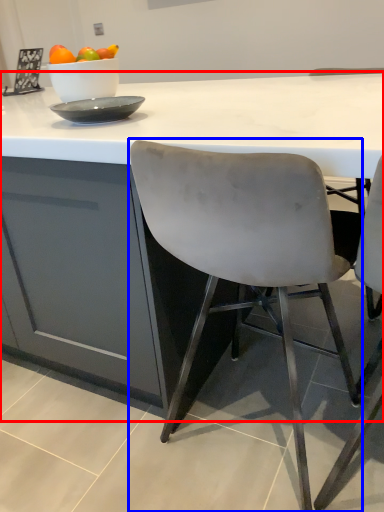
Question: Which point is closer to the camera, table (highlighted by a red box) or chair (highlighted by a blue box)?

Choices:
 (A) table
 (B) chair

Answer: (B)